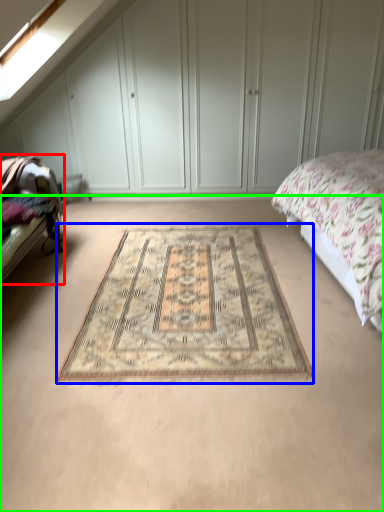
Question: Which object is the farthest from bed frame (highlighted by a red box)? Choose among these: mat (highlighted by a blue box) or plain (highlighted by a green box).

Choices:
 (A) mat
 (B) plain

Answer: (A)